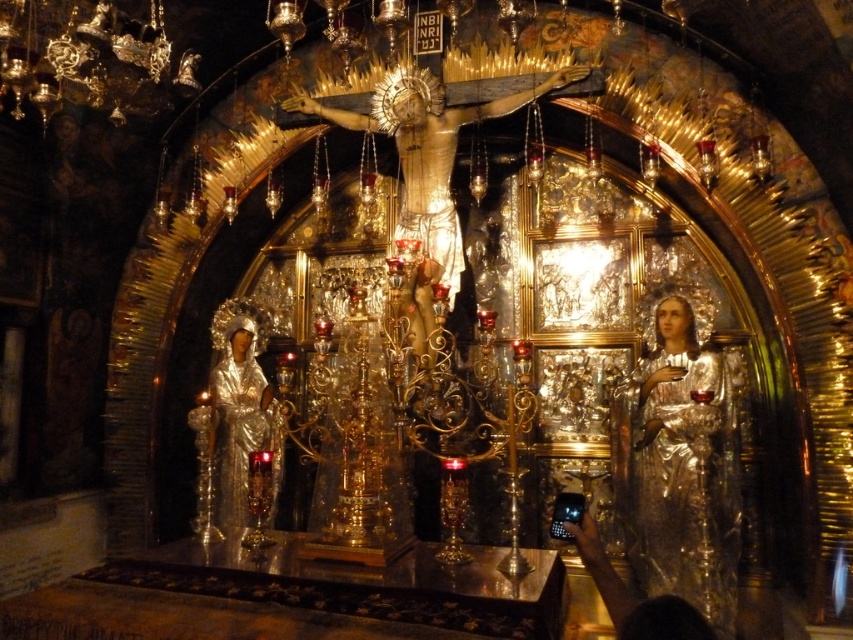
This screenshot has width=853, height=640. What do you see at coordinates (683, 472) in the screenshot? I see `shiny silver statue at right` at bounding box center [683, 472].

Can you confirm if shiny silver statue at right is positioned below silver metallic statue at left?

Correct, shiny silver statue at right is located below silver metallic statue at left.

Which is behind, point (698, 605) or point (265, 417)?

The point (265, 417) is behind.

This screenshot has width=853, height=640. Identify the location of shiny silver statue at right. [x=683, y=472].

Which is behind, point (650, 502) or point (424, 330)?

Point (424, 330)

Does shiny silver statue at right have a greater height compared to gold metallic crucifix at center?

No, shiny silver statue at right is not taller than gold metallic crucifix at center.

Which is in front, point (718, 378) or point (392, 108)?

Point (718, 378) is more forward.

Identify the location of shiny silver statue at right. (683, 472).

Can you confirm if gold metallic crucifix at center is taller than silver metallic statue at left?

Result: Correct, gold metallic crucifix at center is much taller as silver metallic statue at left.

This screenshot has height=640, width=853. I want to click on gold metallic crucifix at center, so click(x=428, y=157).